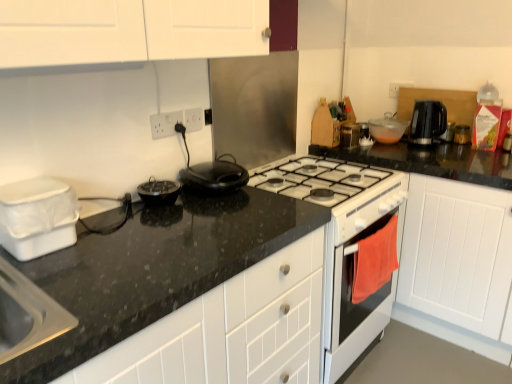
I want to click on free space to the right of black matte waffle maker at center, acting as the 2th kitchen appliance starting from the front, so coord(208,208).